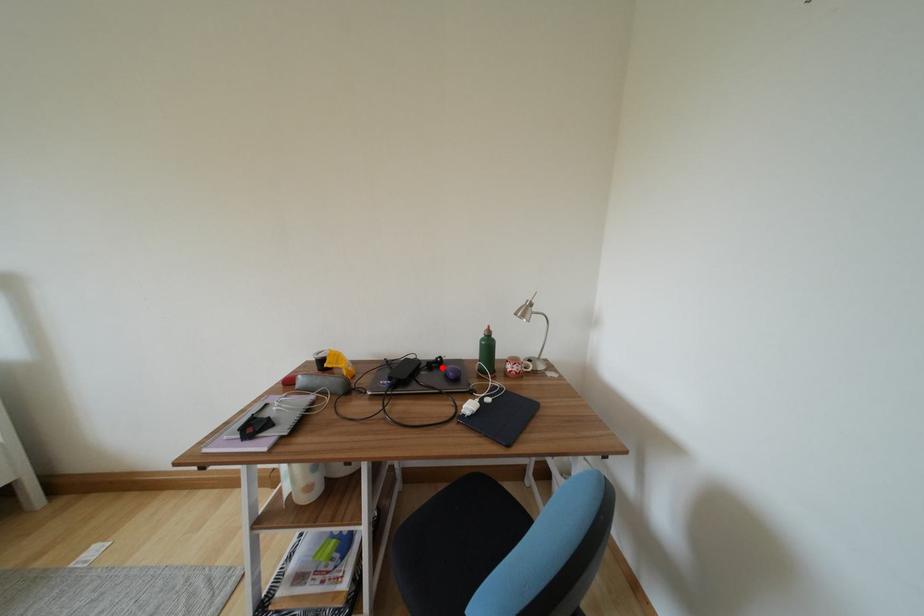
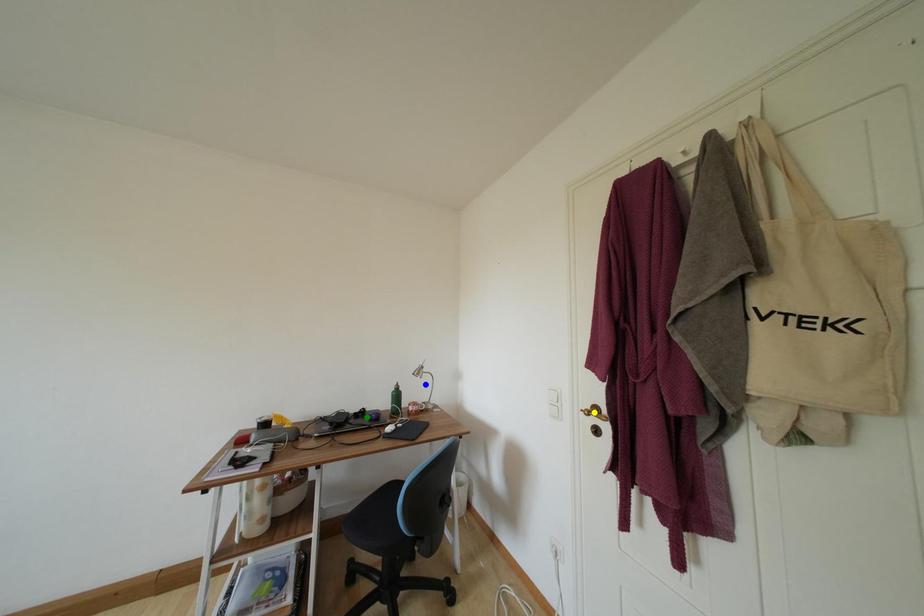
Question: I am providing you with two images of the same scene from different viewpoints. A red point is marked on the first image. You are given multiple points on the second image. Can you choose the point in image 2 that corresponds to the point in image 1?

Choices:
 (A) green point
 (B) blue point
 (C) yellow point

Answer: (A)